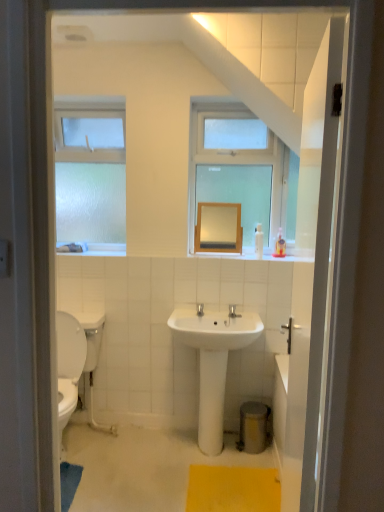
What do you see at coordinates (91, 173) in the screenshot?
I see `frosted glass window at left` at bounding box center [91, 173].

What is the approximate height of yellow textured bath mat at lower center?

yellow textured bath mat at lower center is 4.28 centimeters in height.

Find the location of `white glossy sink at center`. white glossy sink at center is located at coordinates (213, 362).

Which object is positioned more to the left, white glossy sink at center or smooth wooden mirror at center?

From the viewer's perspective, white glossy sink at center appears more on the left side.

Does point (248, 316) lie behind point (201, 220)?

No.

Is white glossy sink at center in front of or behind smooth wooden mirror at center in the image?

Clearly, white glossy sink at center is in front of smooth wooden mirror at center.

Is smooth wooden mirror at center located within white glossy sink at center?

Actually, smooth wooden mirror at center is outside white glossy sink at center.

From the picture: In terms of width, does yellow textured bath mat at lower center look wider or thinner when compared to white glossy sink at center?

Clearly, yellow textured bath mat at lower center has more width compared to white glossy sink at center.

From the image's perspective, which is below, yellow textured bath mat at lower center or white glossy sink at center?

yellow textured bath mat at lower center.

Can you tell me how much yellow textured bath mat at lower center and white glossy sink at center differ in facing direction?

88.7 degrees.

In the scene shown: Considering the sizes of yellow textured bath mat at lower center and white glossy sink at center in the image, is yellow textured bath mat at lower center bigger or smaller than white glossy sink at center?

Considering their sizes, yellow textured bath mat at lower center takes up less space than white glossy sink at center.

Is frosted glass window at left looking in the opposite direction of smooth wooden mirror at center?

frosted glass window at left does not have its back to smooth wooden mirror at center.

Is frosted glass window at left with smooth wooden mirror at center?

frosted glass window at left and smooth wooden mirror at center are not in contact.

Can you confirm if frosted glass window at left is positioned to the left of smooth wooden mirror at center?

Yes, frosted glass window at left is to the left of smooth wooden mirror at center.

Which is closer to the camera, (105, 238) or (219, 239)?

Clearly, point (105, 238) is more distant from the camera than point (219, 239).

In the scene shown: Is white glossy sink at center directly adjacent to yellow textured bath mat at lower center?

white glossy sink at center and yellow textured bath mat at lower center are clearly separated.

How many degrees apart are the facing directions of white glossy sink at center and yellow textured bath mat at lower center?

There is a 88.7-degree angle between the facing directions of white glossy sink at center and yellow textured bath mat at lower center.

Does point (230, 327) come in front of point (196, 496)?

That is False.

In terms of height, does white glossy sink at center look taller or shorter compared to yellow textured bath mat at lower center?

white glossy sink at center is taller than yellow textured bath mat at lower center.

Is white glossy sink at center located within frosted glass window at left?

No, white glossy sink at center is not inside frosted glass window at left.

In the image, is frosted glass window at left on the left side or the right side of white glossy sink at center?

In the image, frosted glass window at left appears on the left side of white glossy sink at center.

Which of these two, frosted glass window at left or white glossy sink at center, stands taller?

Standing taller between the two is frosted glass window at left.

Is frosted glass window at left behind yellow textured bath mat at lower center?

Yes, it is.

Considering the relative sizes of frosted glass window at left and yellow textured bath mat at lower center in the image provided, is frosted glass window at left taller than yellow textured bath mat at lower center?

Yes, frosted glass window at left is taller than yellow textured bath mat at lower center.

Could you tell me if frosted glass window at left is facing yellow textured bath mat at lower center?

No, frosted glass window at left is not aimed at yellow textured bath mat at lower center.

Is frosted glass window at left beside yellow textured bath mat at lower center?

No, frosted glass window at left is not with yellow textured bath mat at lower center.

From the image's perspective, which one is positioned lower, smooth wooden mirror at center or yellow textured bath mat at lower center?

yellow textured bath mat at lower center, from the image's perspective.

Is smooth wooden mirror at center oriented towards yellow textured bath mat at lower center?

No, smooth wooden mirror at center is not facing towards yellow textured bath mat at lower center.

Is smooth wooden mirror at center to the left of yellow textured bath mat at lower center from the viewer's perspective?

Indeed, smooth wooden mirror at center is positioned on the left side of yellow textured bath mat at lower center.

This screenshot has height=512, width=384. I want to click on mirror lying on the right of white glossy sink at center, so click(x=218, y=226).

Identify the location of bath mat directly beneath the white glossy sink at center (from a real-world perspective). The image size is (384, 512). (233, 489).

Looking at this image, looking at the image, which one is located closer to frosted glass window at left, white glossy sink at center or smooth wooden mirror at center?

smooth wooden mirror at center lies closer to frosted glass window at left than the other object.

Which object lies nearer to the anchor point white glossy sink at center, smooth wooden mirror at center or yellow textured bath mat at lower center?

yellow textured bath mat at lower center is closer to white glossy sink at center.

When comparing their distances from smooth wooden mirror at center, does frosted glass window at left or white glossy sink at center seem further?

Based on the image, frosted glass window at left appears to be further to smooth wooden mirror at center.

Looking at the image, which one is located closer to yellow textured bath mat at lower center, white glossy sink at center or frosted glass window at left?

Among the two, white glossy sink at center is located nearer to yellow textured bath mat at lower center.

Estimate the real-world distances between objects in this image. Which object is closer to smooth wooden mirror at center, frosted glass window at left or yellow textured bath mat at lower center?

frosted glass window at left is closer to smooth wooden mirror at center.

Estimate the real-world distances between objects in this image. Which object is closer to white glossy sink at center, smooth wooden mirror at center or frosted glass window at left?

The object closer to white glossy sink at center is smooth wooden mirror at center.

When comparing their distances from yellow textured bath mat at lower center, does smooth wooden mirror at center or white glossy sink at center seem further?

The object further to yellow textured bath mat at lower center is smooth wooden mirror at center.

From the image, which object appears to be nearer to yellow textured bath mat at lower center, frosted glass window at left or white glossy sink at center?

Based on the image, white glossy sink at center appears to be nearer to yellow textured bath mat at lower center.

You are a GUI agent. You are given a task and a screenshot of the screen. Output one action in this format:
    pyautogui.click(x=<x>, y=<y>)
    Task: Click on the mirror between frosted glass window at left and yellow textured bath mat at lower center vertically
    
    Given the screenshot: What is the action you would take?
    pyautogui.click(x=218, y=226)

Where is `mirror that lies between frosted glass window at left and white glossy sink at center from top to bottom`? The image size is (384, 512). mirror that lies between frosted glass window at left and white glossy sink at center from top to bottom is located at coordinates (218, 226).

Where is `sink between smooth wooden mirror at center and yellow textured bath mat at lower center vertically`? This screenshot has width=384, height=512. sink between smooth wooden mirror at center and yellow textured bath mat at lower center vertically is located at coordinates (213, 362).

What are the coordinates of `sink between frosted glass window at left and yellow textured bath mat at lower center vertically` in the screenshot? It's located at (213, 362).